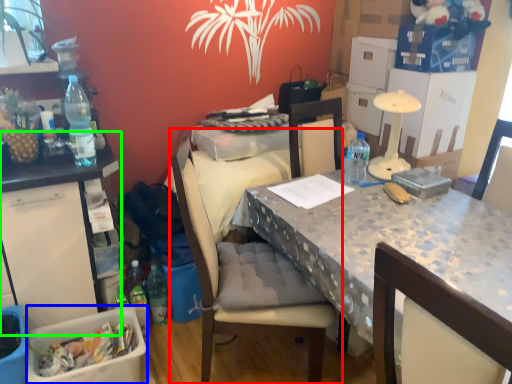
Question: Considering the real-world distances, which object is farthest from chair (highlighted by a red box)? box (highlighted by a blue box) or table (highlighted by a green box)?

Choices:
 (A) box
 (B) table

Answer: (B)